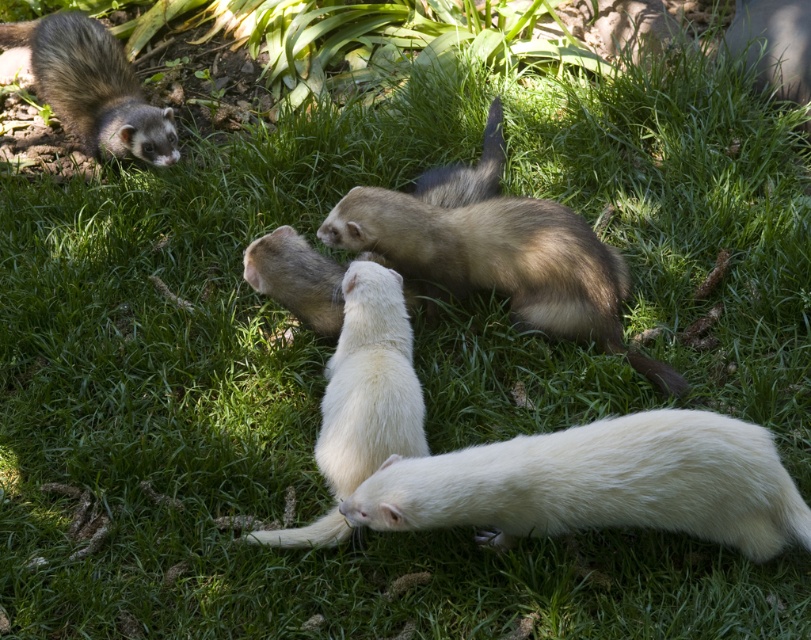
Does white fur ferret at lower center appear on the left side of brown fur ferret at upper left?

Incorrect, white fur ferret at lower center is not on the left side of brown fur ferret at upper left.

Does white fur ferret at lower center have a smaller size compared to brown fur ferret at upper left?

Yes, white fur ferret at lower center is smaller than brown fur ferret at upper left.

Identify the location of white fur ferret at lower center. Image resolution: width=811 pixels, height=640 pixels. (599, 483).